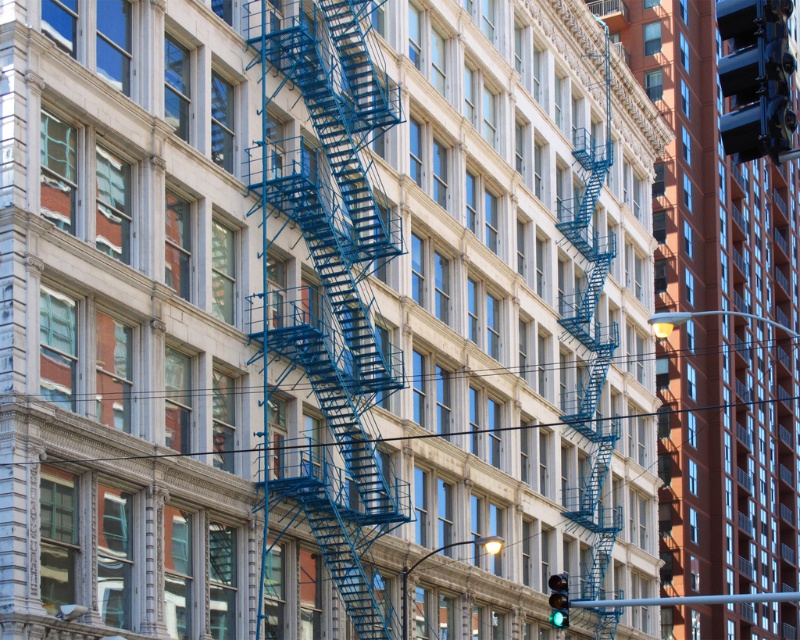
Is blue metal fire escape at center shorter than metallic gray pole at center?

No, blue metal fire escape at center is not shorter than metallic gray pole at center.

Based on the photo, is blue metal fire escape at center taller than metallic gray pole at center?

Yes.

The width and height of the screenshot is (800, 640). In order to click on blue metal fire escape at center in this screenshot , I will do `click(333, 276)`.

At what (x,y) coordinates should I click in order to perform the action: click on blue metal fire escape at center. Please return your answer as a coordinate pair (x, y). Image resolution: width=800 pixels, height=640 pixels. Looking at the image, I should click on (333, 276).

Can you confirm if metallic silver pole at lower center is taller than metallic gray pole at center?

Yes.

Which is below, metallic silver pole at lower center or metallic gray pole at center?

Positioned lower is metallic silver pole at lower center.

Locate an element on the screen. The image size is (800, 640). metallic silver pole at lower center is located at coordinates (690, 600).

Based on the photo, is metallic blue traffic light at upper right below metallic gray pole at center?

No, metallic blue traffic light at upper right is not below metallic gray pole at center.

Is point (756, 90) closer to camera compared to point (401, 625)?

That is True.

Image resolution: width=800 pixels, height=640 pixels. What are the coordinates of `metallic blue traffic light at upper right` in the screenshot? It's located at (756, 77).